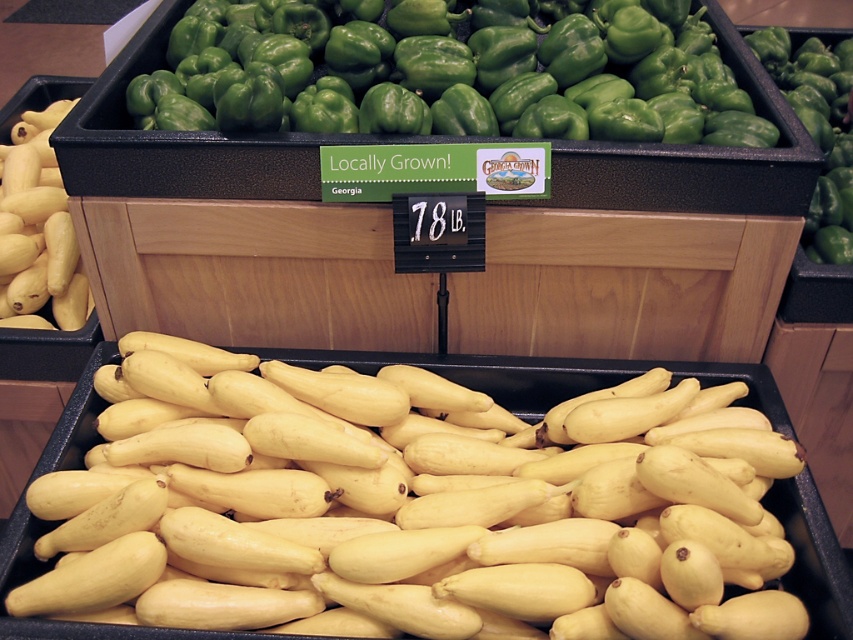
You are a grocery store employee who needs to stack boxes on a shelf. The shelf has limited vertical space. You have two items to place there. The first is the green glossy bell pepper at upper center, and the second is the yellow matte squash at left. Which item should you choose to fit better in the vertical space?

The green glossy bell pepper at upper center is not as tall as the yellow matte squash at left, so the green glossy bell pepper at upper center will fit better in the limited vertical space.

You are a grocery store employee checking the dimensions of the squash. Which squash, the yellow matte squash at center or the yellow matte squash at left, has a greater width?

The yellow matte squash at center might be wider than the yellow matte squash at left according to the description.

You are a grocery store employee arranging vegetables. You have two yellow matte squash at center and yellow matte squash at left. Which squash is more to the right?

The yellow matte squash at center is more to the right because it is positioned on the right side of the yellow matte squash at left.